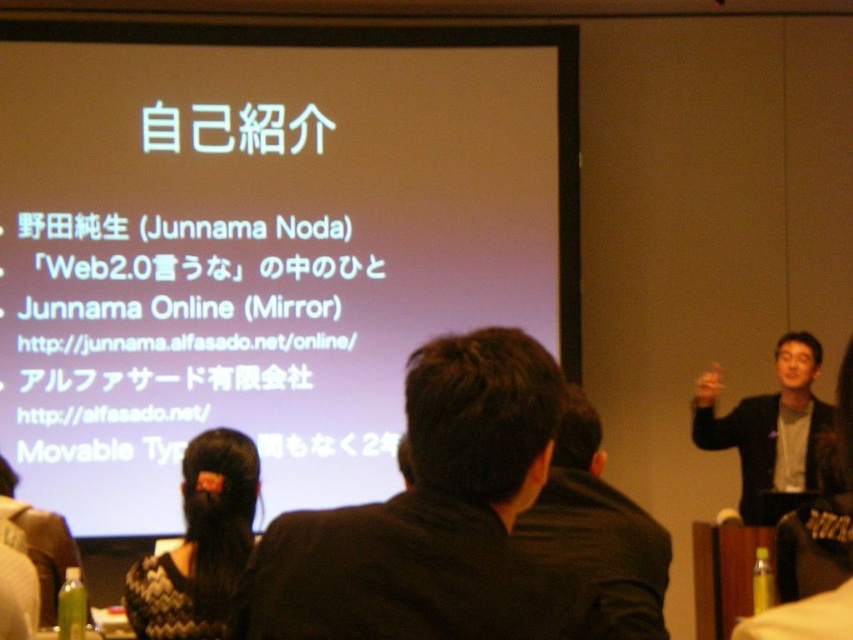
Who is positioned more to the left, dark brown suit at center or black suit at right?

dark brown suit at center is more to the left.

What do you see at coordinates (428, 515) in the screenshot? I see `dark brown suit at center` at bounding box center [428, 515].

What are the coordinates of `dark brown suit at center` in the screenshot? It's located at (428, 515).

Can you confirm if white matte projection screen at upper center is thinner than dark brown suit at center?

In fact, white matte projection screen at upper center might be wider than dark brown suit at center.

Can you confirm if white matte projection screen at upper center is positioned to the right of dark brown suit at center?

Incorrect, white matte projection screen at upper center is not on the right side of dark brown suit at center.

Is point (281, 380) in front of point (316, 602)?

No, it is not.

This screenshot has height=640, width=853. Identify the location of white matte projection screen at upper center. (263, 243).

Describe the element at coordinates (598, 531) in the screenshot. I see `black suit at center` at that location.

Who is shorter, black suit at center or black knitted sweater at lower left?

Standing shorter between the two is black suit at center.

In order to click on black suit at center in this screenshot , I will do `click(598, 531)`.

Find the location of `black suit at center`. black suit at center is located at coordinates (598, 531).